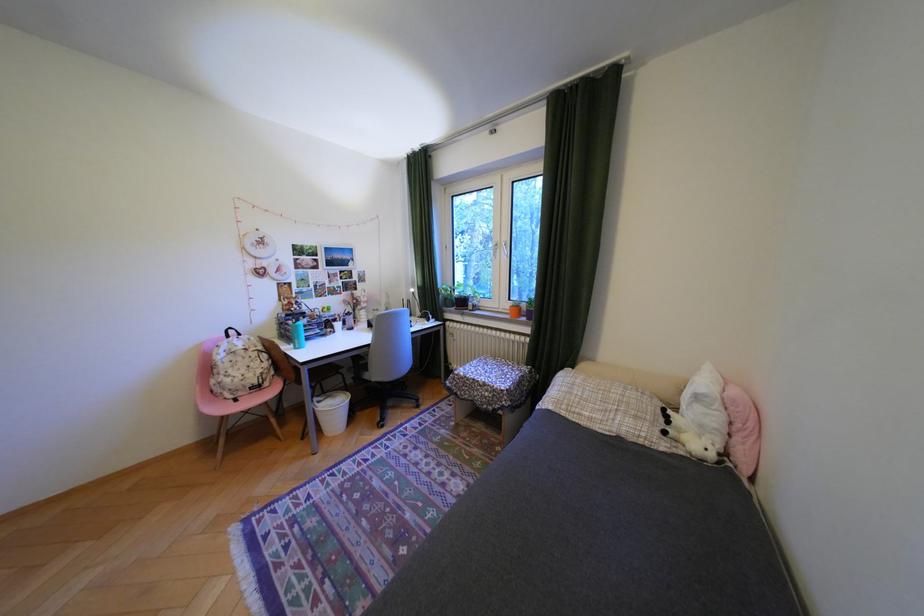
Describe the element at coordinates (687, 437) in the screenshot. The image size is (924, 616). I see `a stuffed animal toy` at that location.